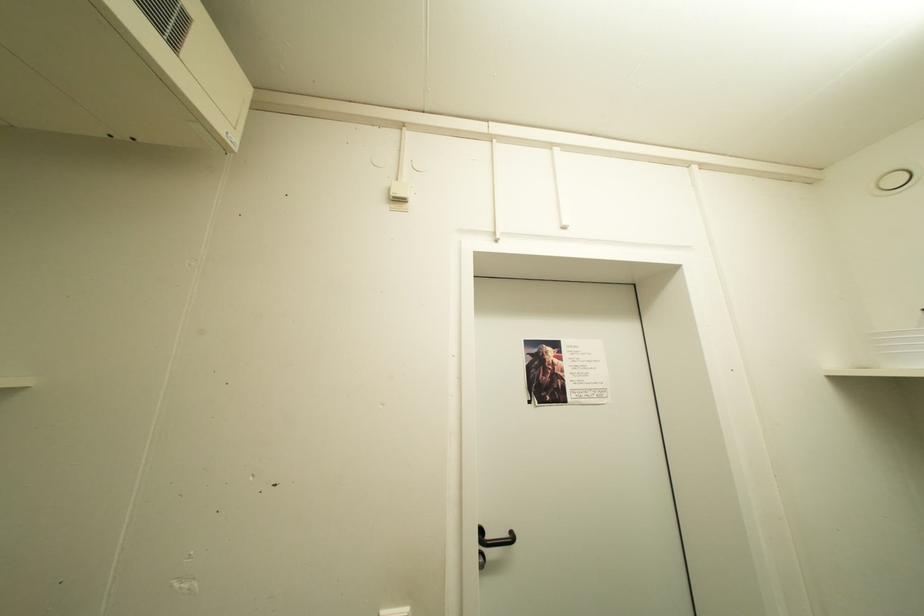
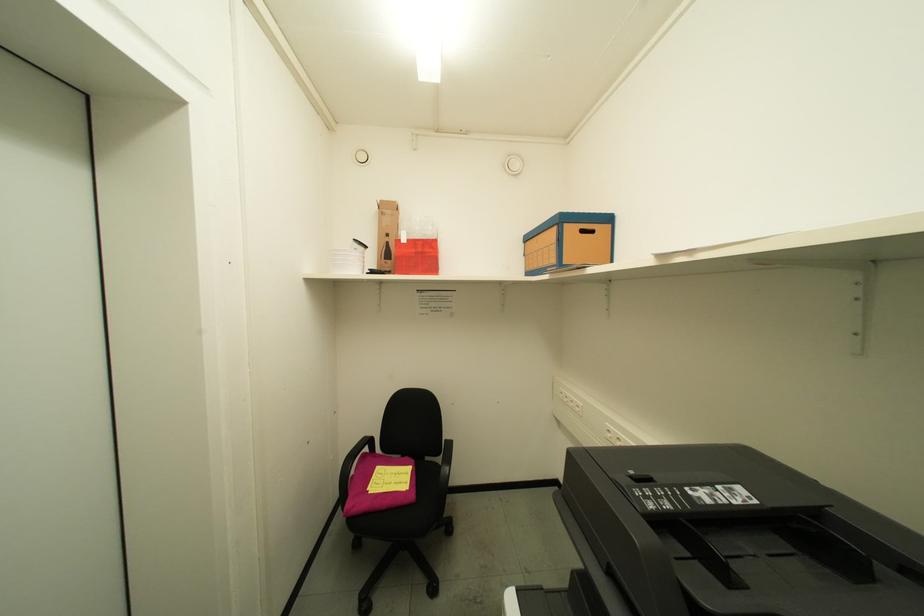
Question: The camera is either moving clockwise (left) or counter-clockwise (right) around the object. The first image is from the beginning of the video and the second image is from the end. Is the camera moving left or right when shooting the video?

Choices:
 (A) Left
 (B) Right

Answer: (A)